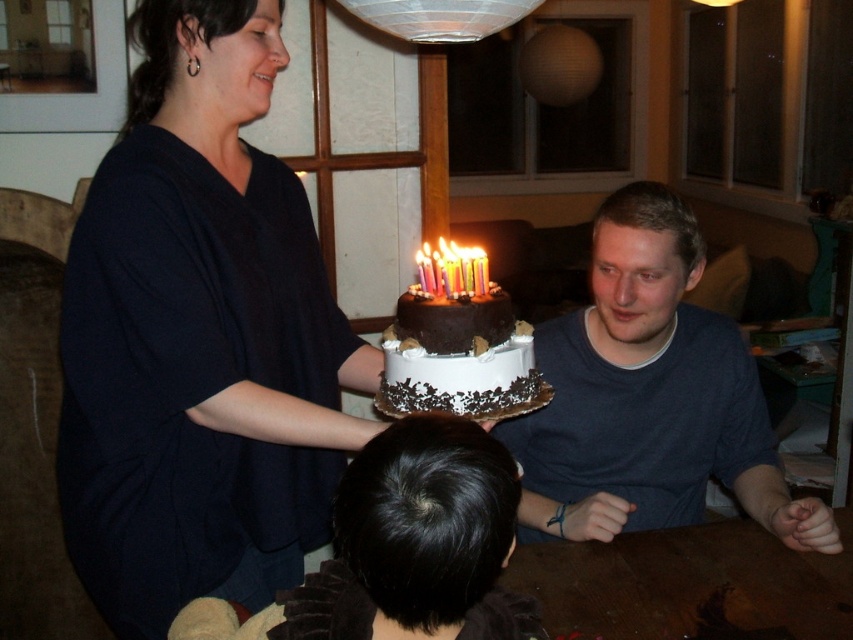
You are a photographer standing near the camera. You want to take a photo of the matte dark blue shirt at center. Can you reach the shirt to adjust it before taking the photo if you can only extend your arm 3 feet?

The matte dark blue shirt at center and camera are 4.51 feet apart. Since your arm can only extend 3 feet, you cannot reach the shirt to adjust it before taking the photo.

You are a photographer aiming to capture the birthday cake without any distractions. Given the scene, can you position yourself so that the matte dark blue shirt at center is not blocking the chocolate frosted cake at center in the photo?

The matte dark blue shirt at center is positioned under the chocolate frosted cake at center, so if you angle your camera slightly upward, you can capture the cake without the shirt blocking it.

You are standing in the living room and want to reach the point marked as point (126, 552). If your walking speed is 3 feet per second, how many seconds will it take you to reach that point?

The point (126, 552) is 3.87 feet away from the viewer. At a speed of 3 feet per second, it would take approximately 1.29 seconds to reach the point.